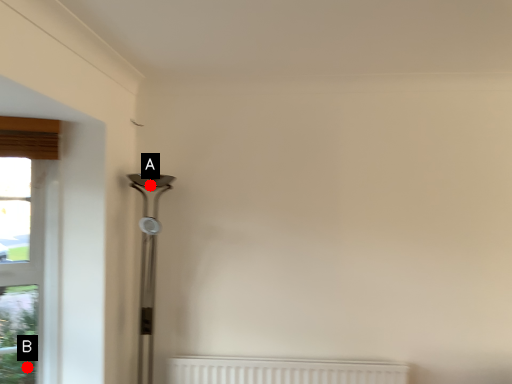
Question: Two points are circled on the image, labeled by A and B beside each circle. Which point is further to the camera?

Choices:
 (A) A is further
 (B) B is further

Answer: (A)